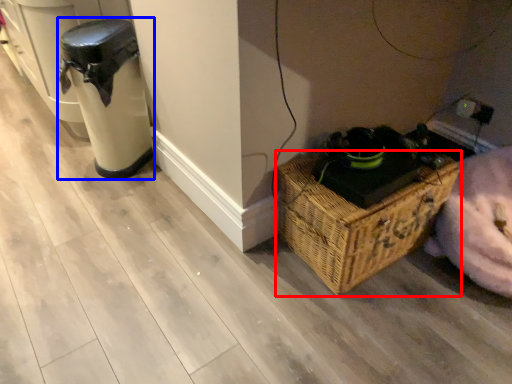
Question: Among these objects, which one is nearest to the camera, picnic basket (highlighted by a red box) or appliance (highlighted by a blue box)?

Choices:
 (A) picnic basket
 (B) appliance

Answer: (A)